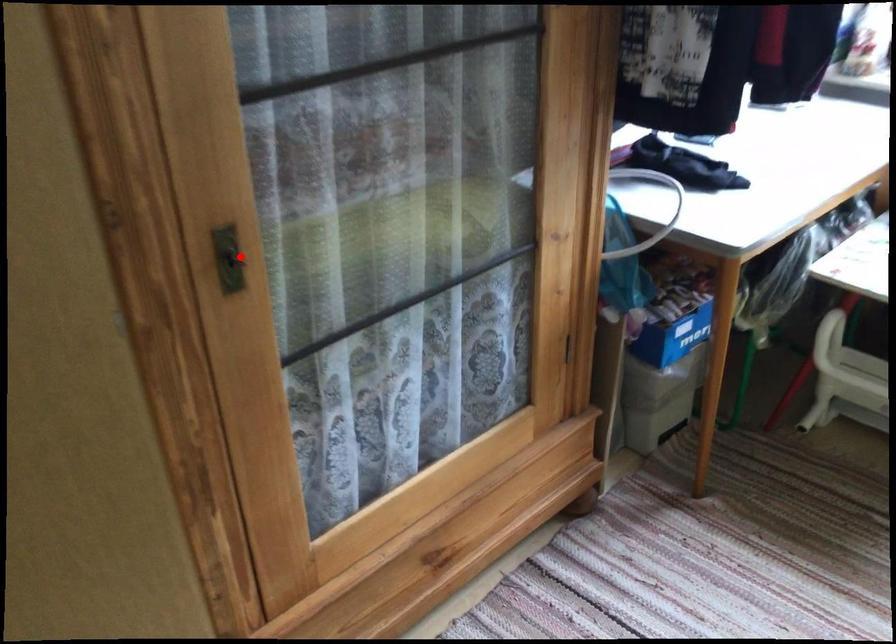
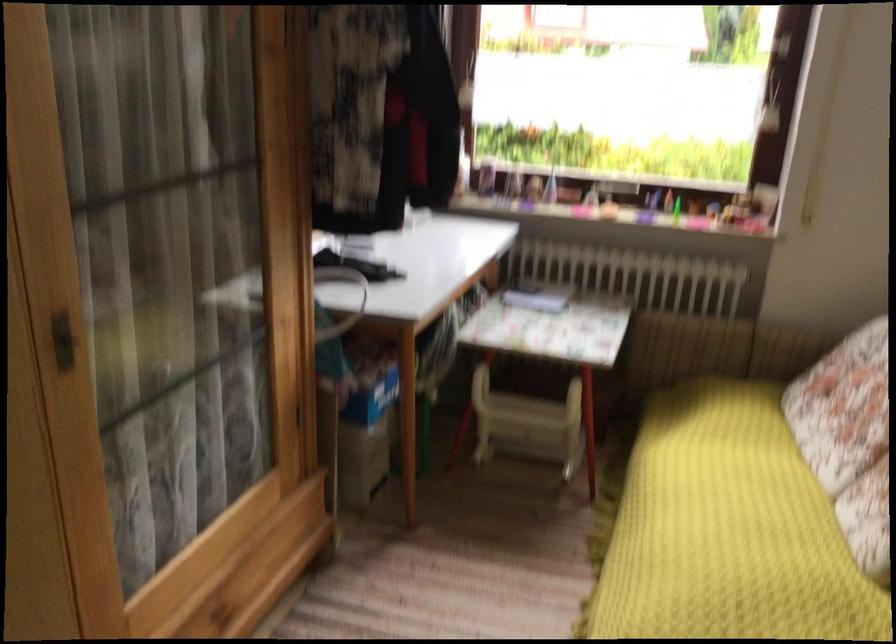
Question: A red point is marked in image1. In image2, is the corresponding 3D point closer to the camera or farther? Reply with the corresponding letter.

Choices:
 (A) The corresponding 3D point is closer.
 (B) The corresponding 3D point is farther.

Answer: (B)